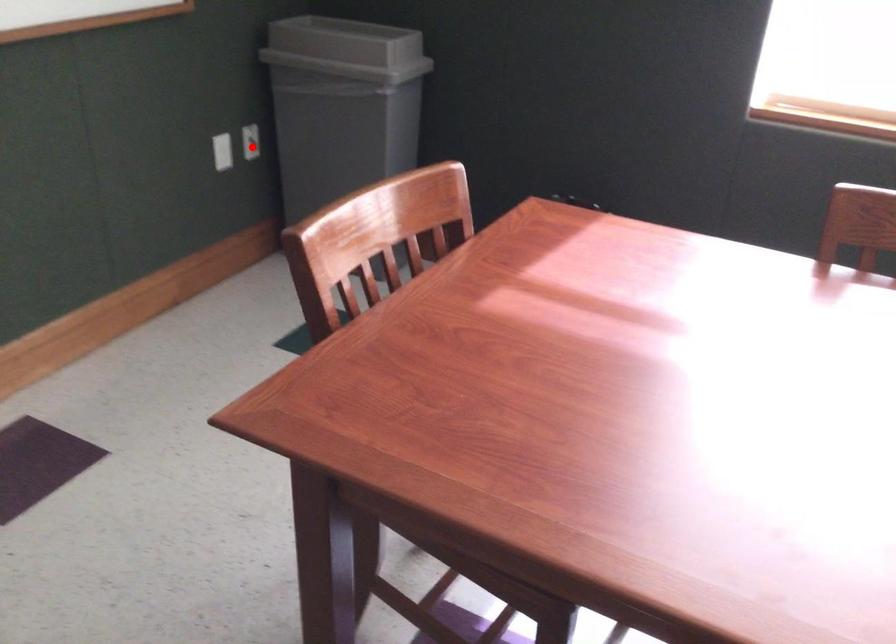
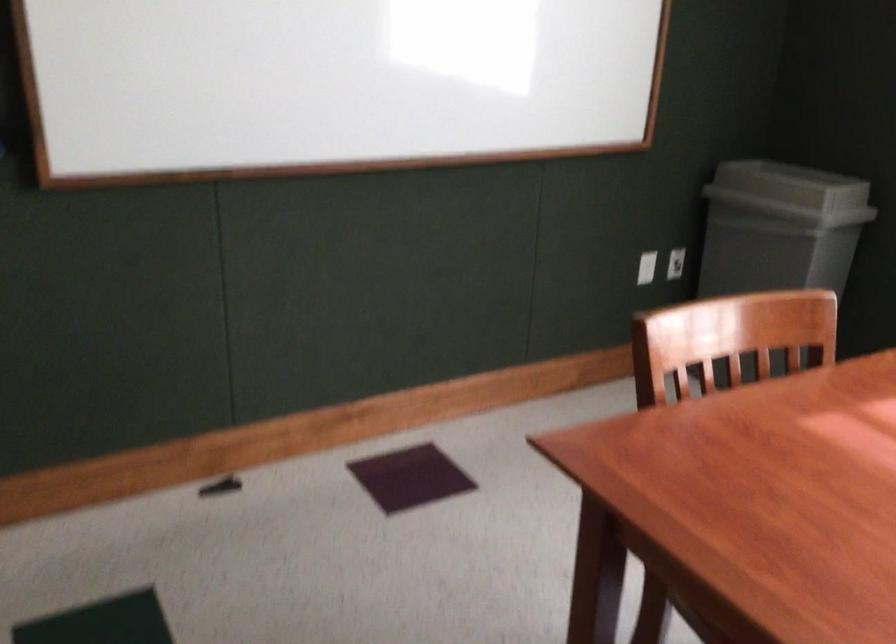
Find the pixel in the second image that matches the highlighted location in the first image.

(675, 263)